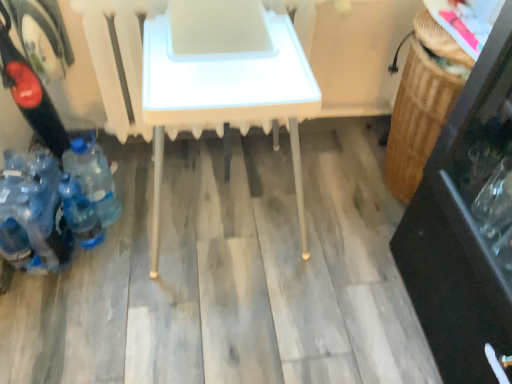
This screenshot has height=384, width=512. Identify the location of vacant region in front of white plastic table at center. (204, 328).